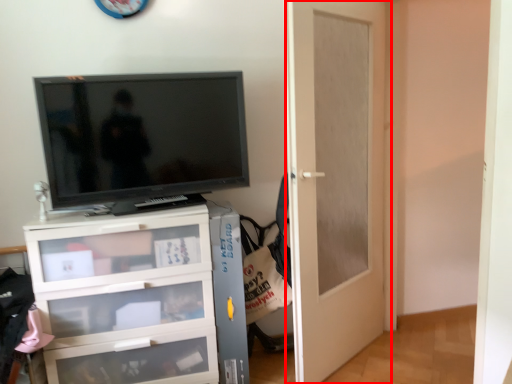
Question: From the image, what is the correct spatial relationship of door (annotated by the red box) in relation to television?

Choices:
 (A) right
 (B) left

Answer: (A)